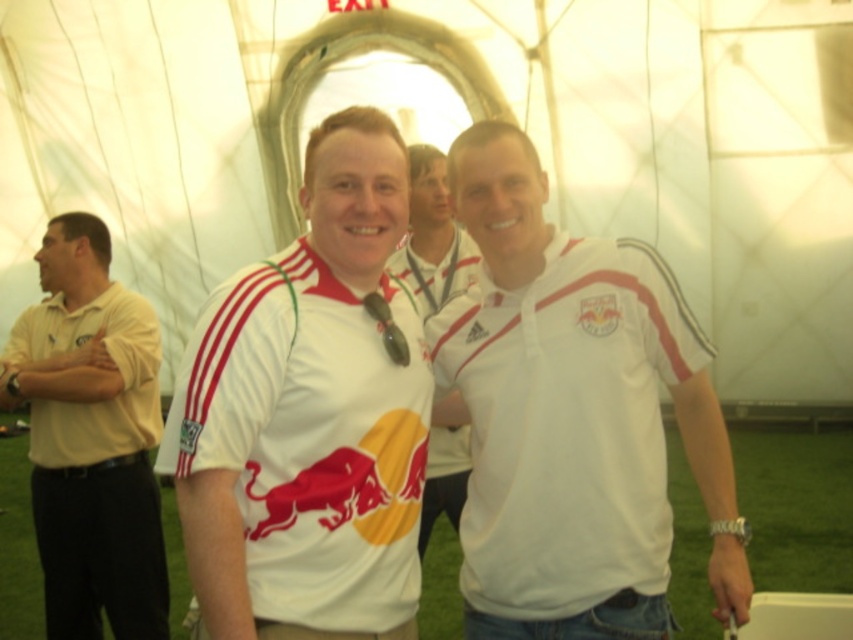
Question: Based on their relative distances, which object is nearer to the white matte jersey at center?

Choices:
 (A) matte yellow polo shirt at left
 (B) white matte shirt at center
 (C) white fabric shirt at center

Answer: (B)

Question: Where is white matte shirt at center located in relation to white matte jersey at center in the image?

Choices:
 (A) below
 (B) above

Answer: (A)

Question: Which of the following is the farthest from the observer?

Choices:
 (A) white matte jersey at center
 (B) white matte shirt at center
 (C) matte yellow polo shirt at left

Answer: (C)

Question: Can you confirm if white matte shirt at center is positioned below white matte jersey at center?

Choices:
 (A) yes
 (B) no

Answer: (A)

Question: Which point is farther from the camera taking this photo?

Choices:
 (A) [x=454, y=381]
 (B) [x=198, y=436]
 (C) [x=426, y=292]
 (D) [x=85, y=410]

Answer: (C)

Question: Does white matte shirt at center have a smaller size compared to matte yellow polo shirt at left?

Choices:
 (A) no
 (B) yes

Answer: (A)